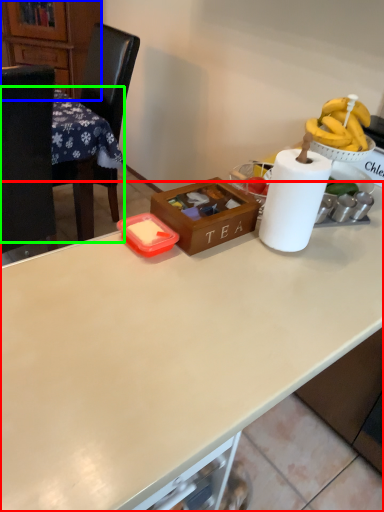
Question: Considering the real-world distances, which object is farthest from desk (highlighted by a red box)? cabinetry (highlighted by a blue box) or table (highlighted by a green box)?

Choices:
 (A) cabinetry
 (B) table

Answer: (A)